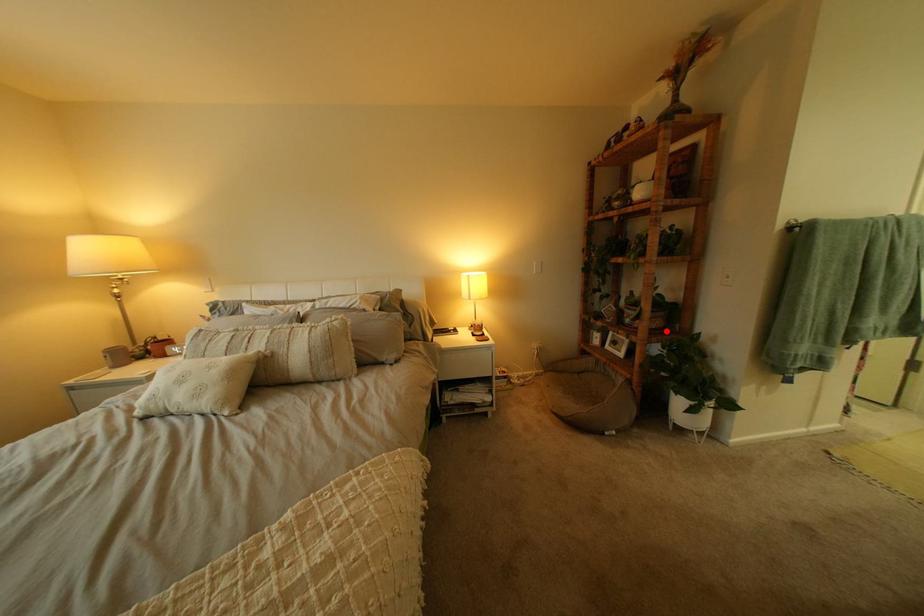
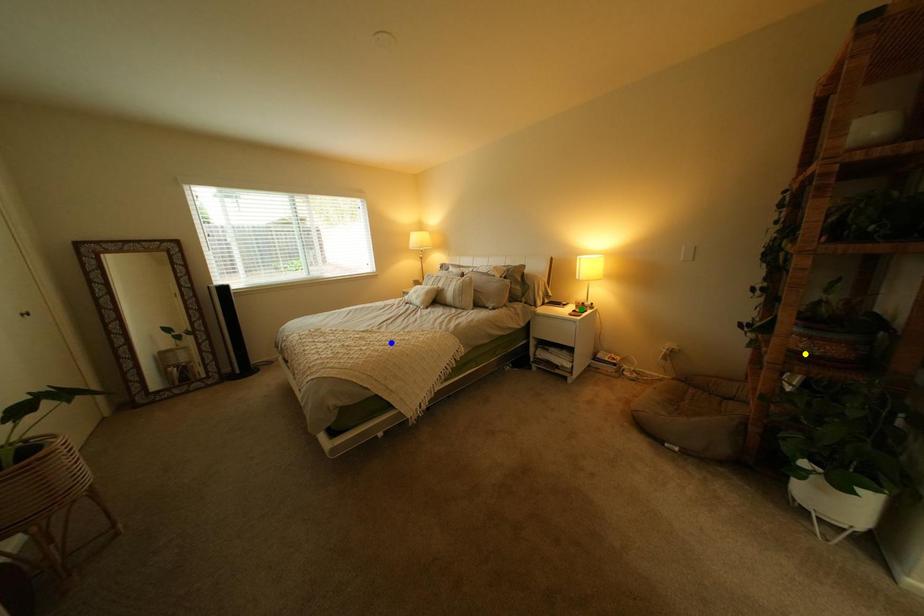
Question: I am providing you with two images of the same scene from different viewpoints. A red point is marked on the first image. You are given multiple points on the second image. Which point in image 2 represents the same 3d spot as the red point in image 1?

Choices:
 (A) blue point
 (B) green point
 (C) yellow point

Answer: (C)